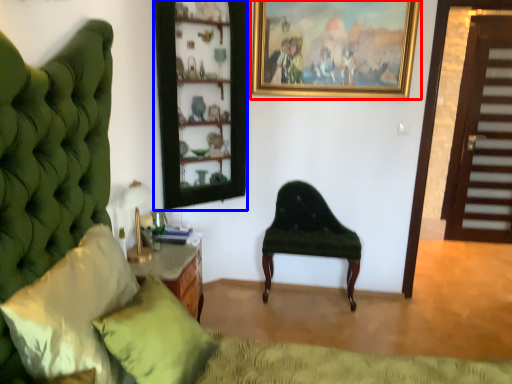
Question: Which of the following is the farthest to the observer, picture frame (highlighted by a red box) or shelf (highlighted by a blue box)?

Choices:
 (A) picture frame
 (B) shelf

Answer: (A)